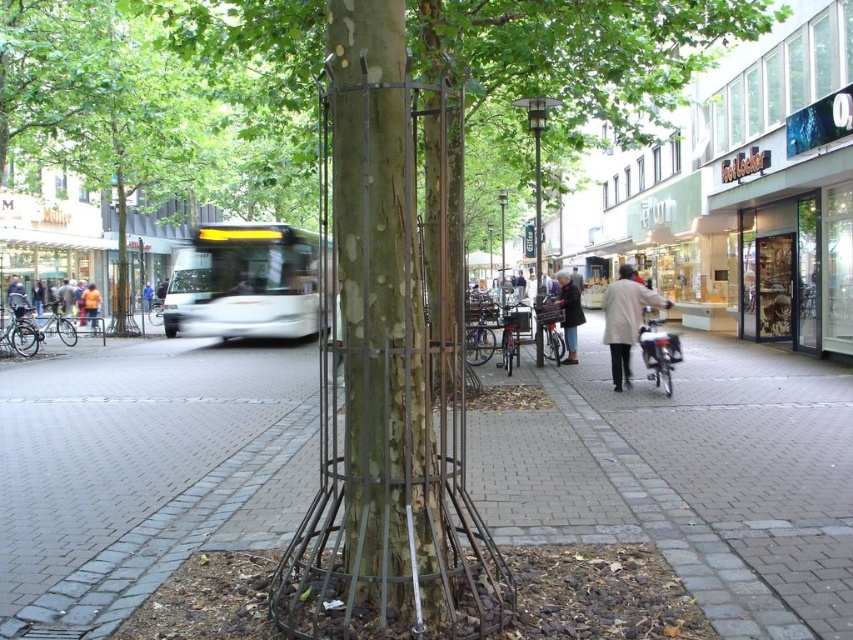
Question: Does orange jacket at left appear on the left side of orange jacket at center?

Choices:
 (A) no
 (B) yes

Answer: (B)

Question: In this image, where is light beige coat at center located relative to dark gray coat at center?

Choices:
 (A) below
 (B) above

Answer: (A)

Question: Which of these objects is positioned farthest from the dark gray coat at center?

Choices:
 (A) orange jacket at left
 (B) brick pavement at center

Answer: (A)

Question: Among these points, which one is farthest from the camera?

Choices:
 (A) (628, 328)
 (B) (564, 317)

Answer: (B)

Question: Estimate the real-world distances between objects in this image. Which object is farther from the orange jacket at center?

Choices:
 (A) light brown leather jacket at center
 (B) orange jacket at left

Answer: (A)

Question: Does metallic wire cage at center appear on the right side of blue fabric jacket at center?

Choices:
 (A) yes
 (B) no

Answer: (A)